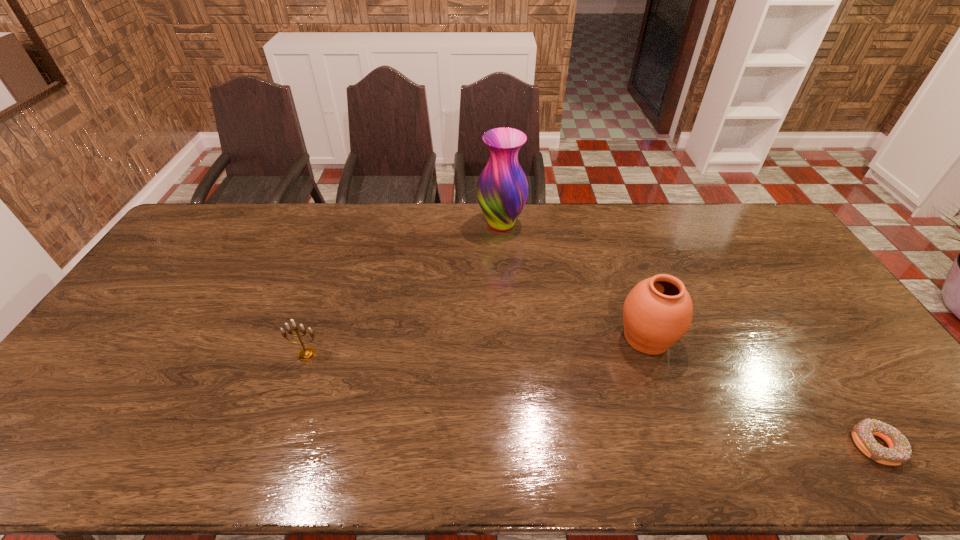
Locate an element on the screen. This screenshot has width=960, height=540. free space between the rightmost object and the tallest object is located at coordinates (688, 335).

Where is `empty space that is in between the urn and the nearest object`? The width and height of the screenshot is (960, 540). empty space that is in between the urn and the nearest object is located at coordinates (761, 392).

This screenshot has height=540, width=960. I want to click on free space between the second object from right to left and the farthest object, so click(574, 281).

At what (x,y) coordinates should I click in order to perform the action: click on empty space between the doughnut and the candelabrum. Please return your answer as a coordinate pair (x, y). This screenshot has width=960, height=540. Looking at the image, I should click on (x=591, y=400).

Locate an element on the screen. This screenshot has width=960, height=540. empty space that is in between the second object from right to left and the candelabrum is located at coordinates (x=477, y=346).

You are a GUI agent. You are given a task and a screenshot of the screen. Output one action in this format:
    pyautogui.click(x=<x>, y=<y>)
    Task: Click on the free spot between the second tallest object and the nearest object
    
    Given the screenshot: What is the action you would take?
    pyautogui.click(x=761, y=392)

Identify the location of free spot between the leftmost object and the second object from left to right. (404, 289).

Identify the location of free space that is in between the shortest object and the candelabrum. (591, 400).

At what (x,y) coordinates should I click in order to perform the action: click on free spot between the second object from left to right and the urn. Please return your answer as a coordinate pair (x, y). Image resolution: width=960 pixels, height=540 pixels. Looking at the image, I should click on (574, 281).

I want to click on free spot between the vase and the leftmost object, so click(x=404, y=289).